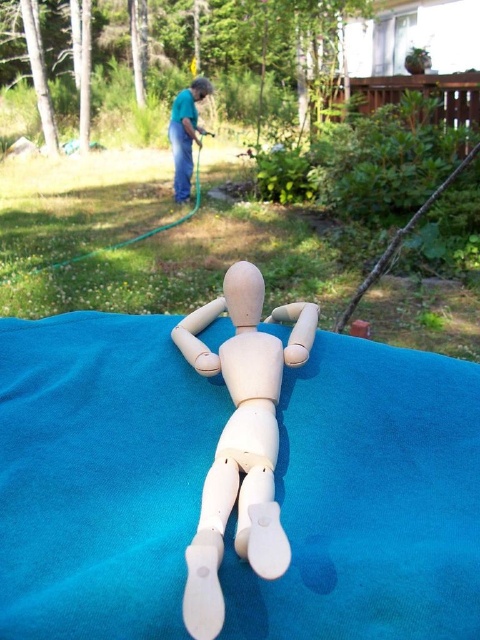
Who is lower down, wooden mannequin at center or blue fabric doll at upper center?

wooden mannequin at center is lower down.

Can you confirm if wooden mannequin at center is positioned above blue fabric doll at upper center?

No.

At what (x,y) coordinates should I click in order to perform the action: click on wooden mannequin at center. Please return your answer as a coordinate pair (x, y). Looking at the image, I should click on (240, 440).

Where is `white matte tablecloth at center`? white matte tablecloth at center is located at coordinates (98, 476).

Is white matte tablecloth at center positioned in front of wooden mannequin at center?

No, white matte tablecloth at center is further to the viewer.

Who is more distant from viewer, (190, 445) or (252, 323)?

The point (252, 323) is more distant.

Find the location of a particular element. The image size is (480, 640). white matte tablecloth at center is located at coordinates (98, 476).

Who is shorter, white matte tablecloth at center or blue fabric doll at upper center?

white matte tablecloth at center is shorter.

Can you confirm if white matte tablecloth at center is thinner than blue fabric doll at upper center?

No, white matte tablecloth at center is not thinner than blue fabric doll at upper center.

The image size is (480, 640). Identify the location of white matte tablecloth at center. (98, 476).

The width and height of the screenshot is (480, 640). Identify the location of white matte tablecloth at center. (98, 476).